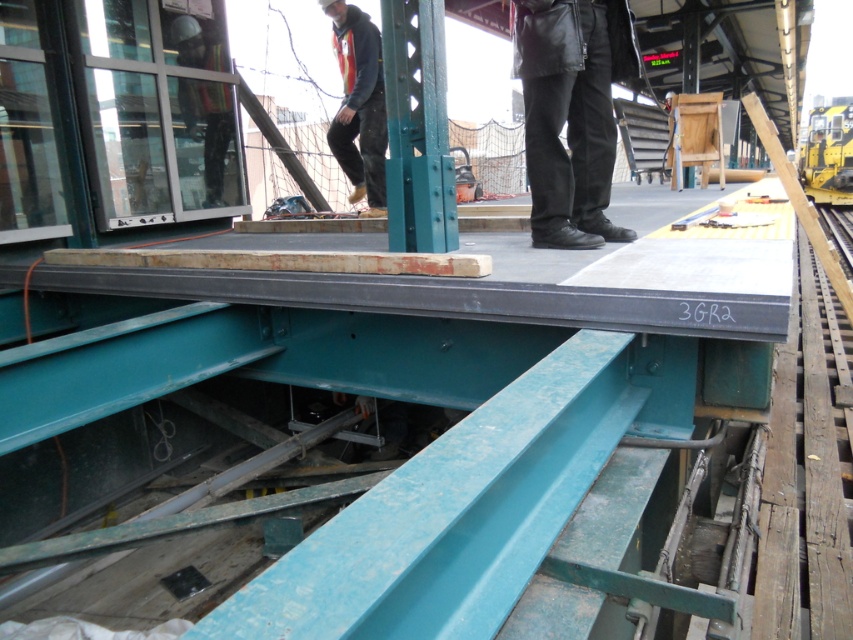
You are a maintenance worker on the platform. You need to move from your current position to a tool located at point (573, 244). However, there is an obstacle at point (364, 36). Will you encounter the obstacle on your way to the tool?

Point (573, 244) is in front of point (364, 36), so you will encounter the obstacle at point (364, 36) on your way to the tool.